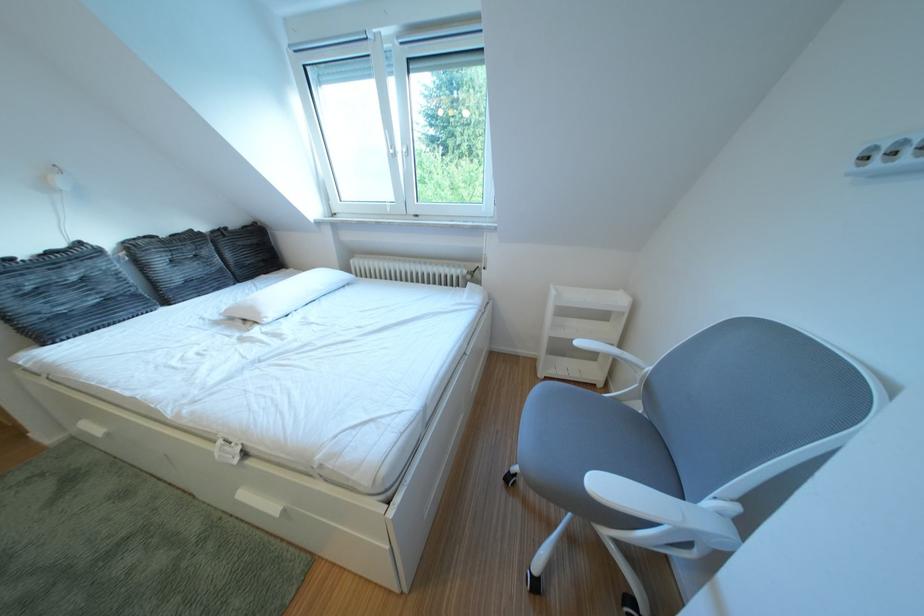
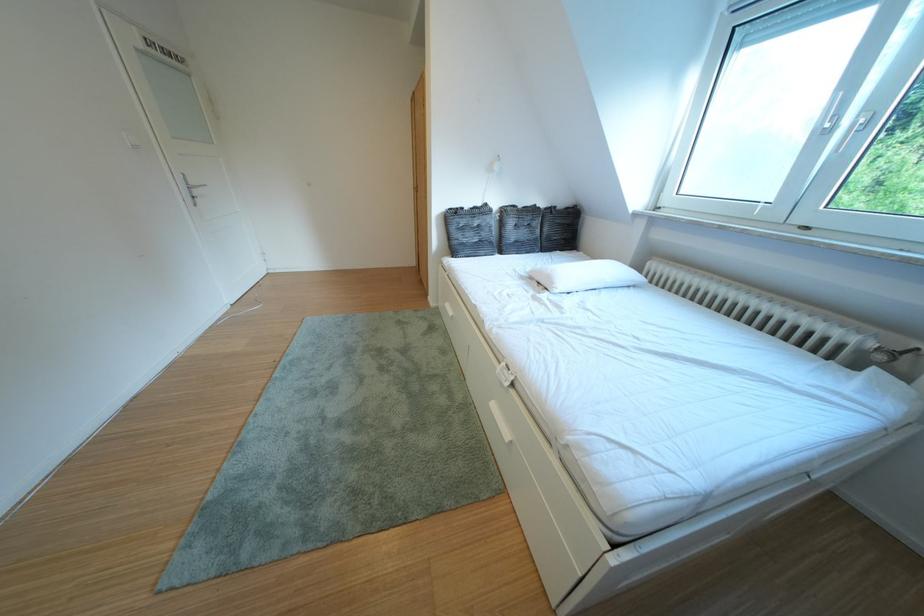
Where in the second image is the point corresponding to point 46,325 from the first image?

(468, 246)